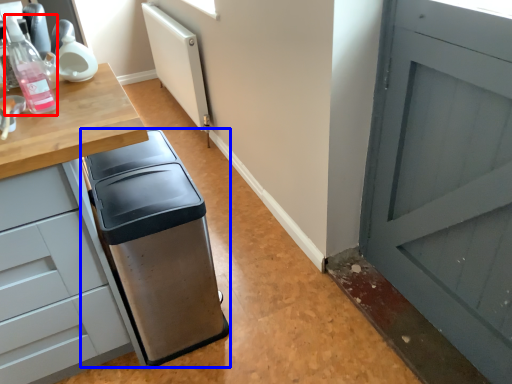
Question: Among these objects, which one is nearest to the camera, bottle (highlighted by a red box) or waste container (highlighted by a blue box)?

Choices:
 (A) bottle
 (B) waste container

Answer: (A)